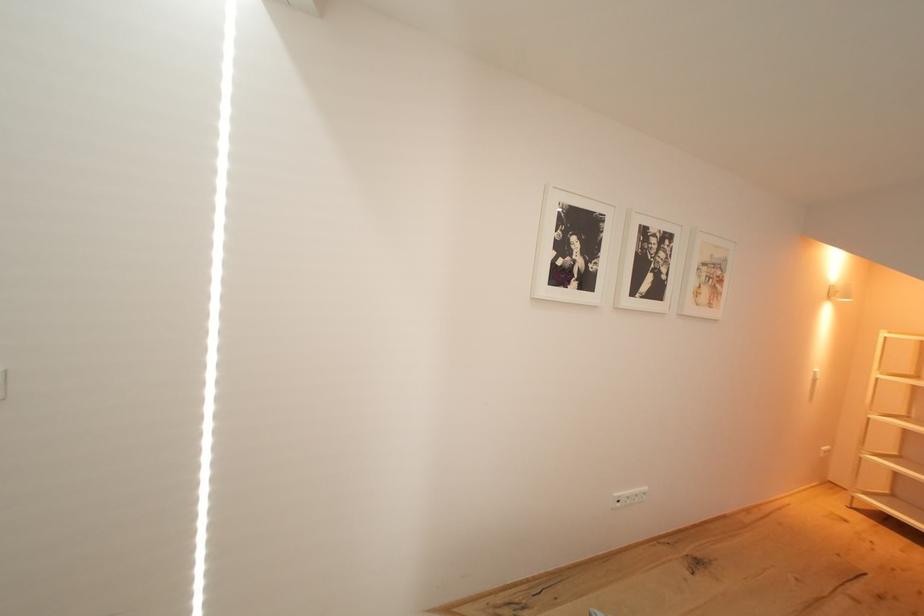
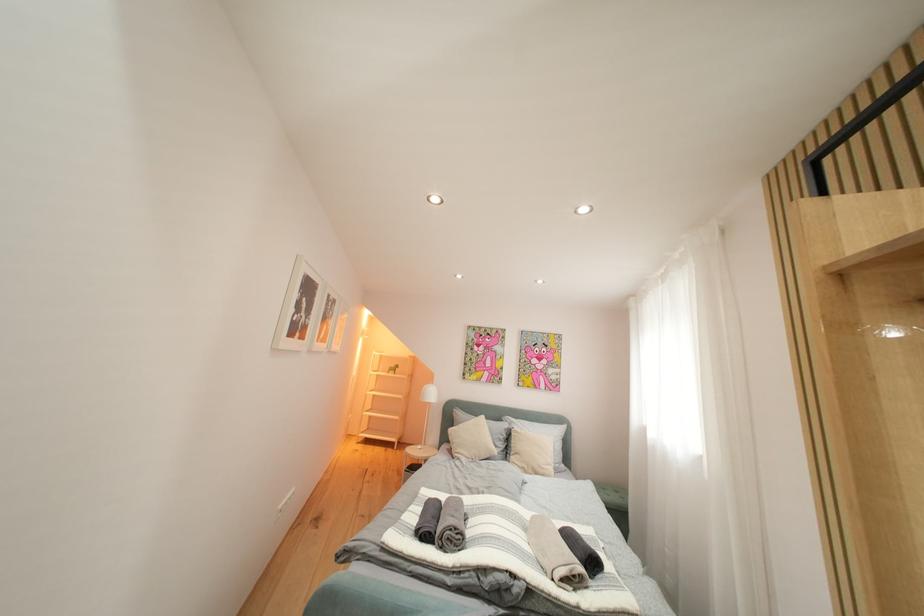
Question: The images are taken continuously from a first-person perspective. In which direction is your viewpoint rotating?

Choices:
 (A) Left
 (B) Right
 (C) Up
 (D) Down

Answer: (B)